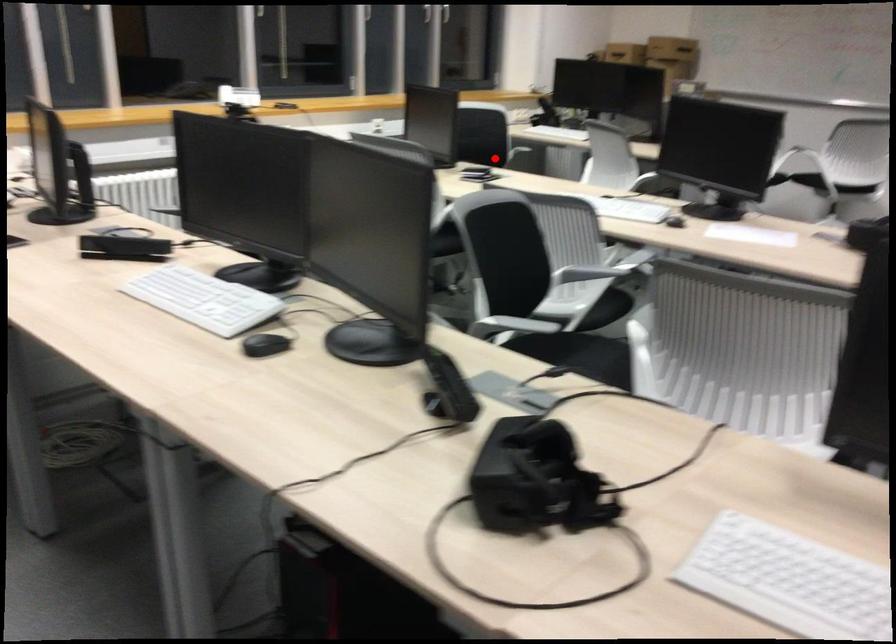
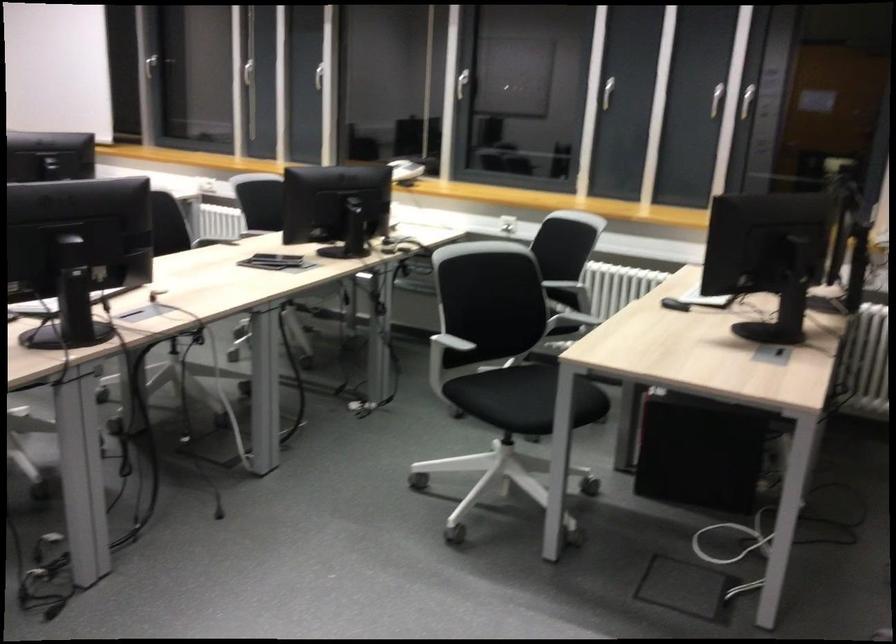
Question: I am providing you with two images of the same scene from different viewpoints. A red point is shown in image1. For the corresponding object point in image2, is it positioned nearer or farther from the camera?

Choices:
 (A) Nearer
 (B) Farther

Answer: (A)